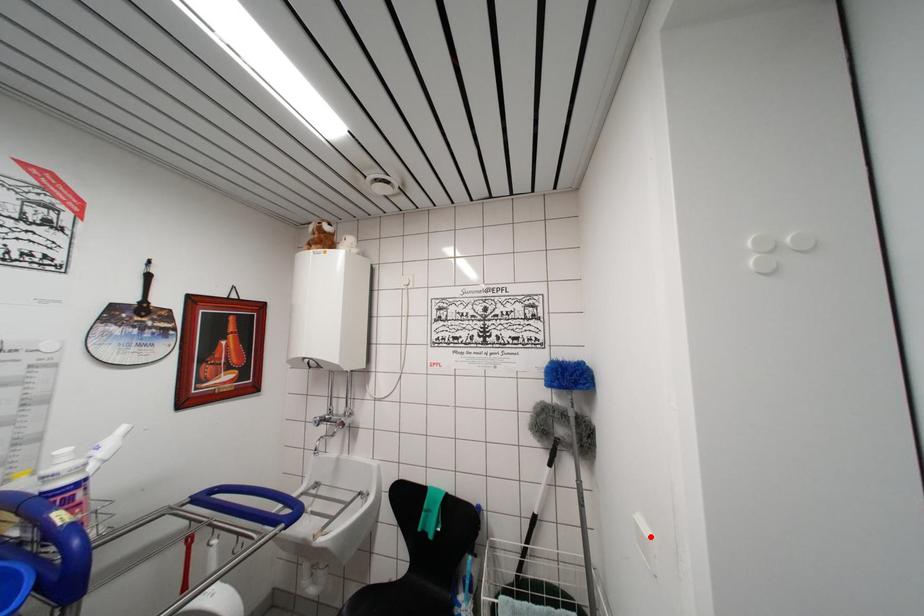
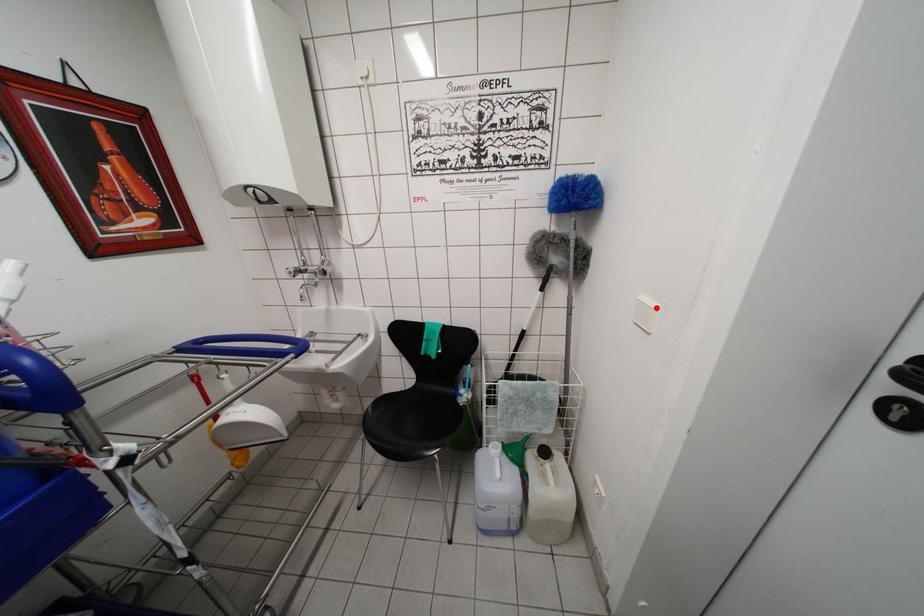
I am providing you with two images of the same scene from different viewpoints. A red point is marked on the first image and another point is marked on the second image. Does the point marked in image1 correspond to the same location as the one in image2?

Yes